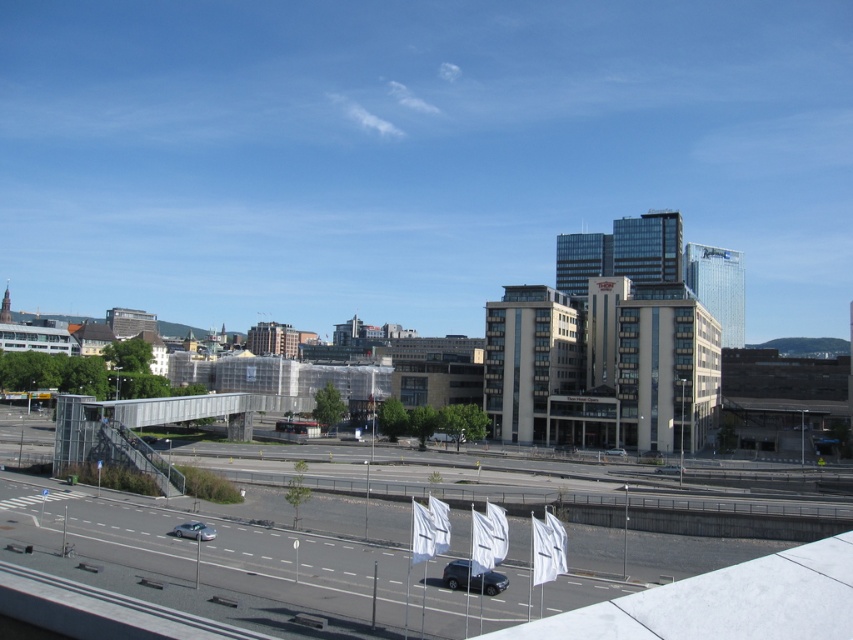
Question: From the image, what is the correct spatial relationship of white fabric flags at lower center in relation to metallic gray overpass at center?

Choices:
 (A) above
 (B) below

Answer: (A)

Question: Does white fabric flags at lower center appear on the right side of metallic gray overpass at center?

Choices:
 (A) no
 (B) yes

Answer: (B)

Question: Estimate the real-world distances between objects in this image. Which object is farther from the matte black suv at center?

Choices:
 (A) satin silver car at lower left
 (B) metallic gray overpass at center

Answer: (B)

Question: Does white fabric flags at lower center appear on the right side of satin silver car at lower left?

Choices:
 (A) no
 (B) yes

Answer: (B)

Question: Among these points, which one is nearest to the camera?

Choices:
 (A) (498, 576)
 (B) (132, 556)

Answer: (A)

Question: Considering the real-world distances, which object is farthest from the metallic gray overpass at center?

Choices:
 (A) satin silver car at lower left
 (B) matte black suv at center

Answer: (A)